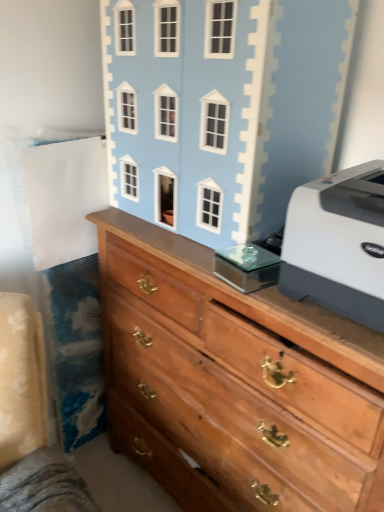
Question: From a real-world perspective, is wooden chest of drawers at center under white plastic printer at right?

Choices:
 (A) no
 (B) yes

Answer: (B)

Question: Can you confirm if wooden chest of drawers at center is smaller than white plastic printer at right?

Choices:
 (A) yes
 (B) no

Answer: (B)

Question: Can you confirm if wooden chest of drawers at center is wider than white plastic printer at right?

Choices:
 (A) yes
 (B) no

Answer: (A)

Question: Is wooden chest of drawers at center located outside white plastic printer at right?

Choices:
 (A) no
 (B) yes

Answer: (B)

Question: From the image's perspective, is wooden chest of drawers at center beneath white plastic printer at right?

Choices:
 (A) no
 (B) yes

Answer: (B)

Question: Looking at the image, does light blue painted wood dollhouse at upper center seem bigger or smaller compared to wooden chest of drawers at center?

Choices:
 (A) big
 (B) small

Answer: (B)

Question: From a real-world perspective, is light blue painted wood dollhouse at upper center physically located above or below wooden chest of drawers at center?

Choices:
 (A) above
 (B) below

Answer: (A)

Question: In the image, is light blue painted wood dollhouse at upper center positioned in front of or behind wooden chest of drawers at center?

Choices:
 (A) front
 (B) behind

Answer: (B)

Question: Considering the positions of light blue painted wood dollhouse at upper center and wooden chest of drawers at center in the image, is light blue painted wood dollhouse at upper center wider or thinner than wooden chest of drawers at center?

Choices:
 (A) thin
 (B) wide

Answer: (A)

Question: In terms of width, does wooden chest of drawers at center look wider or thinner when compared to light blue painted wood dollhouse at upper center?

Choices:
 (A) wide
 (B) thin

Answer: (A)

Question: From the image's perspective, is wooden chest of drawers at center above or below light blue painted wood dollhouse at upper center?

Choices:
 (A) above
 (B) below

Answer: (B)

Question: From a real-world perspective, is wooden chest of drawers at center positioned above or below light blue painted wood dollhouse at upper center?

Choices:
 (A) below
 (B) above

Answer: (A)

Question: Is wooden chest of drawers at center inside or outside of light blue painted wood dollhouse at upper center?

Choices:
 (A) outside
 (B) inside

Answer: (A)

Question: Does point (375, 236) appear closer or farther from the camera than point (210, 301)?

Choices:
 (A) farther
 (B) closer

Answer: (B)

Question: Is white plastic printer at right wider or thinner than wooden chest of drawers at center?

Choices:
 (A) thin
 (B) wide

Answer: (A)